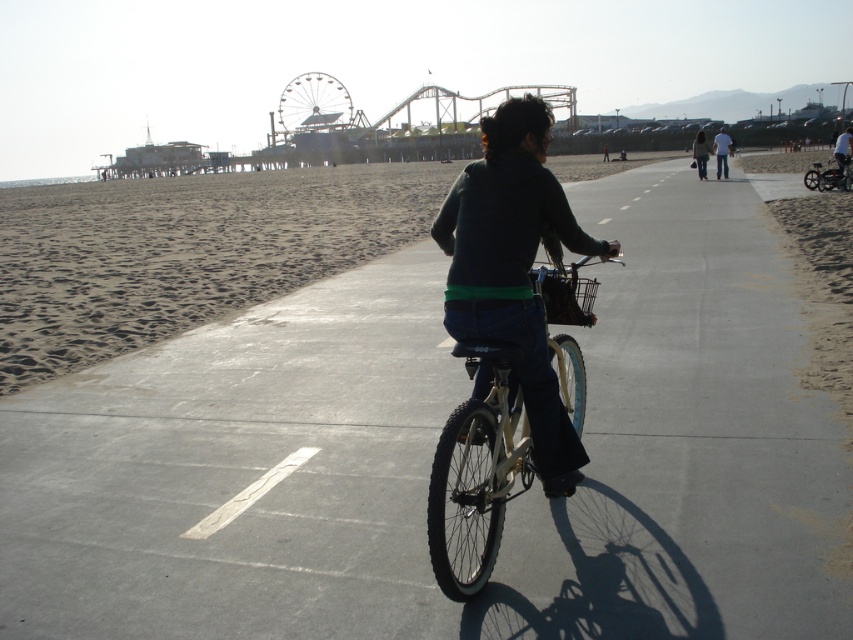
You are standing on the beachside promenade and want to walk from point A to point B. Point A is located at coordinates point (360, 145) and point B is at point (836, 168). Given the path is wide and smooth, will you walk towards the direction away from or closer to the beach?

Point (360, 145) is further to the viewer than point (836, 168). Therefore, walking from point A to point B would be moving away from the beach since the path slopes downward towards the beach, making point B closer to the beach than point A.